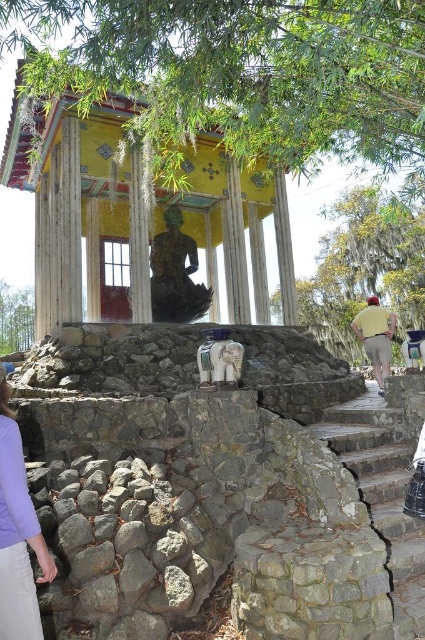
Question: Where is gray stone stairs at lower right located in relation to greenish-yellow painted statue at center in the image?

Choices:
 (A) above
 (B) below

Answer: (B)

Question: Does light purple fabric at lower left appear on the right side of greenish-yellow painted statue at center?

Choices:
 (A) no
 (B) yes

Answer: (B)

Question: Estimate the real-world distances between objects in this image. Which object is closer to the greenish-yellow painted statue at center?

Choices:
 (A) yellow cotton shirt at right
 (B) yellow painted wood gazebo at center

Answer: (B)

Question: Which of the following is the farthest from the observer?

Choices:
 (A) light purple fabric at lower left
 (B) yellow painted wood gazebo at center
 (C) yellow cotton shirt at right
 (D) greenish-yellow painted statue at center

Answer: (D)

Question: Which object is positioned closest to the gray stone stairs at lower right?

Choices:
 (A) yellow painted wood gazebo at center
 (B) yellow cotton shirt at right
 (C) greenish-yellow painted statue at center
 (D) light purple fabric at lower left

Answer: (B)

Question: Considering the relative positions of yellow painted wood gazebo at center and yellow cotton shirt at right in the image provided, where is yellow painted wood gazebo at center located with respect to yellow cotton shirt at right?

Choices:
 (A) right
 (B) left

Answer: (B)